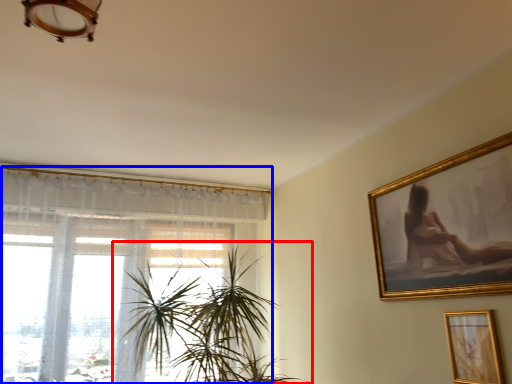
Question: Among these objects, which one is farthest to the camera, houseplant (highlighted by a red box) or window (highlighted by a blue box)?

Choices:
 (A) houseplant
 (B) window

Answer: (B)